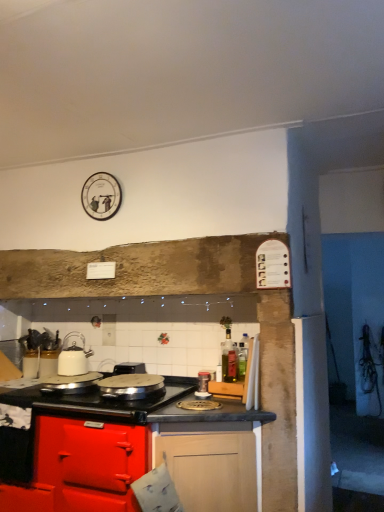
Describe the element at coordinates (71, 383) in the screenshot. This screenshot has height=512, width=384. I see `shiny silver pan at center, placed as the 3th kitchen appliance when sorted from right to left` at that location.

Image resolution: width=384 pixels, height=512 pixels. What are the coordinates of `black plastic toaster at center` in the screenshot? It's located at (129, 368).

From a real-world perspective, which object stands above the other?

white glossy kettle at left, marked as the second kitchen appliance in a right-to-left arrangement, from a real-world perspective.

Can you confirm if white glossy kettle at left, marked as the second kitchen appliance in a left-to-right arrangement, is taller than glossy wood cabinet at lower center?

No, white glossy kettle at left, marked as the second kitchen appliance in a left-to-right arrangement, is not taller than glossy wood cabinet at lower center.

What are the coordinates of `cabinetry located below the white glossy kettle at left, marked as the second kitchen appliance in a left-to-right arrangement (from the image's perspective)` in the screenshot? It's located at (131, 452).

Could you measure the distance between white glossy kettle at left, marked as the second kitchen appliance in a left-to-right arrangement, and glossy wood cabinet at lower center?

A distance of 25.98 inches exists between white glossy kettle at left, marked as the second kitchen appliance in a left-to-right arrangement, and glossy wood cabinet at lower center.

From the picture: How different are the orientations of white glossy kettle at left, marked as the second kitchen appliance in a right-to-left arrangement, and green glass bottle at center in degrees?

They differ by 2.81 degrees in their facing directions.

Considering the sizes of objects white glossy kettle at left, marked as the second kitchen appliance in a left-to-right arrangement, and green glass bottle at center in the image provided, who is taller, white glossy kettle at left, marked as the second kitchen appliance in a left-to-right arrangement, or green glass bottle at center?

Standing taller between the two is white glossy kettle at left, marked as the second kitchen appliance in a left-to-right arrangement.

Is white glossy kettle at left, marked as the second kitchen appliance in a left-to-right arrangement, turned away from green glass bottle at center?

No.

Which of these two, white glossy kettle at left, marked as the second kitchen appliance in a left-to-right arrangement, or green glass bottle at center, is wider?

white glossy kettle at left, marked as the second kitchen appliance in a left-to-right arrangement, is wider.

Which is more distant, (61,387) or (187,410)?

Point (61,387)

Does shiny silver pan at center, placed as the 3th kitchen appliance when sorted from right to left, have a larger size compared to glossy wood cabinet at lower center?

No, shiny silver pan at center, placed as the 3th kitchen appliance when sorted from right to left, is not bigger than glossy wood cabinet at lower center.

Does shiny silver pan at center, placed as the 3th kitchen appliance when sorted from right to left, appear on the right side of glossy wood cabinet at lower center?

No.

From the image's perspective, does shiny silver pan at center, placed as the 3th kitchen appliance when sorted from right to left, appear lower than glossy wood cabinet at lower center?

Actually, shiny silver pan at center, placed as the 3th kitchen appliance when sorted from right to left, appears above glossy wood cabinet at lower center in the image.

Is the depth of metallic silver canister at center, which appears as the third kitchen appliance when viewed from the left, less than that of glossy wood cabinet at lower center?

No, metallic silver canister at center, which appears as the third kitchen appliance when viewed from the left, is further to the viewer.

From a real-world perspective, which object rests below the other?

From a 3D spatial view, glossy wood cabinet at lower center is below.

How far apart are metallic silver canister at center, which appears as the third kitchen appliance when viewed from the left, and glossy wood cabinet at lower center?

The distance of metallic silver canister at center, which appears as the third kitchen appliance when viewed from the left, from glossy wood cabinet at lower center is 22.58 inches.

Considering the relative sizes of metallic silver canister at center, the 1th kitchen appliance from the right, and glossy wood cabinet at lower center in the image provided, is metallic silver canister at center, the 1th kitchen appliance from the right, wider than glossy wood cabinet at lower center?

Incorrect, the width of metallic silver canister at center, the 1th kitchen appliance from the right, does not surpass that of glossy wood cabinet at lower center.

Based on the photo, is metallic silver canister at center, which appears as the third kitchen appliance when viewed from the left, turned away from white glossy kettle at left, marked as the second kitchen appliance in a left-to-right arrangement?

metallic silver canister at center, which appears as the third kitchen appliance when viewed from the left, is not turned away from white glossy kettle at left, marked as the second kitchen appliance in a left-to-right arrangement.

Does point (210, 393) appear closer or farther from the camera than point (72, 346)?

Point (210, 393) is closer to the camera than point (72, 346).

From the image's perspective, is metallic silver canister at center, which appears as the third kitchen appliance when viewed from the left, positioned above or below white glossy kettle at left, marked as the second kitchen appliance in a right-to-left arrangement?

From the image's perspective, metallic silver canister at center, which appears as the third kitchen appliance when viewed from the left, appears below white glossy kettle at left, marked as the second kitchen appliance in a right-to-left arrangement.

Is metallic silver canister at center, the 1th kitchen appliance from the right, closer to the viewer compared to white glossy kettle at left, marked as the second kitchen appliance in a left-to-right arrangement?

Yes, metallic silver canister at center, the 1th kitchen appliance from the right, is in front of white glossy kettle at left, marked as the second kitchen appliance in a left-to-right arrangement.

Between glossy wood cabinet at lower center and white glossy kettle at left, marked as the second kitchen appliance in a right-to-left arrangement, which one appears on the right side from the viewer's perspective?

glossy wood cabinet at lower center.

Who is taller, glossy wood cabinet at lower center or white glossy kettle at left, marked as the second kitchen appliance in a right-to-left arrangement?

With more height is glossy wood cabinet at lower center.

Is white glossy kettle at left, marked as the second kitchen appliance in a left-to-right arrangement, surrounded by glossy wood cabinet at lower center?

No.

Is shiny silver pan at center, the 1th kitchen appliance from the left, to the right of green glass bottle at center from the viewer's perspective?

No, shiny silver pan at center, the 1th kitchen appliance from the left, is not to the right of green glass bottle at center.

Does shiny silver pan at center, the 1th kitchen appliance from the left, come in front of green glass bottle at center?

Yes, it is.

From a real-world perspective, is shiny silver pan at center, the 1th kitchen appliance from the left, physically located above or below green glass bottle at center?

From a real-world perspective, shiny silver pan at center, the 1th kitchen appliance from the left, is physically below green glass bottle at center.

Is shiny silver pan at center, placed as the 3th kitchen appliance when sorted from right to left, not within green glass bottle at center?

shiny silver pan at center, placed as the 3th kitchen appliance when sorted from right to left, lies outside green glass bottle at center's area.

You are a GUI agent. You are given a task and a screenshot of the screen. Output one action in this format:
    pyautogui.click(x=<x>, y=<y>)
    Task: Click on the 3rd kitchen appliance behind when counting from the glossy wood cabinet at lower center
    The image size is (384, 512).
    Given the screenshot: What is the action you would take?
    pyautogui.click(x=73, y=357)

Locate an element on the screen. bottle that is below the white glossy kettle at left, marked as the second kitchen appliance in a left-to-right arrangement (from the image's perspective) is located at coordinates (229, 359).

When comparing their distances from metallic silver canister at center, which appears as the third kitchen appliance when viewed from the left, does white glossy kettle at left, marked as the second kitchen appliance in a right-to-left arrangement, or glossy wood cabinet at lower center seem further?

Based on the image, white glossy kettle at left, marked as the second kitchen appliance in a right-to-left arrangement, appears to be further to metallic silver canister at center, which appears as the third kitchen appliance when viewed from the left.

Estimate the real-world distances between objects in this image. Which object is further from black plastic toaster at center, white glossy kettle at left, marked as the second kitchen appliance in a right-to-left arrangement, or green glass bottle at center?

The object further to black plastic toaster at center is green glass bottle at center.

Looking at the image, which one is located closer to metallic silver canister at center, the 1th kitchen appliance from the right, black plastic toaster at center or green glass bottle at center?

Among the two, green glass bottle at center is located nearer to metallic silver canister at center, the 1th kitchen appliance from the right.

When comparing their distances from white glossy kettle at left, marked as the second kitchen appliance in a left-to-right arrangement, does glossy wood cabinet at lower center or black plastic toaster at center seem closer?

black plastic toaster at center lies closer to white glossy kettle at left, marked as the second kitchen appliance in a left-to-right arrangement, than the other object.

Based on their spatial positions, is metallic silver canister at center, the 1th kitchen appliance from the right, or shiny silver pan at center, the 1th kitchen appliance from the left, closer to white glossy kettle at left, marked as the second kitchen appliance in a right-to-left arrangement?

shiny silver pan at center, the 1th kitchen appliance from the left, is positioned closer to the anchor white glossy kettle at left, marked as the second kitchen appliance in a right-to-left arrangement.

Looking at the image, which one is located closer to shiny silver pan at center, placed as the 3th kitchen appliance when sorted from right to left, green glass bottle at center or metallic silver canister at center, the 1th kitchen appliance from the right?

metallic silver canister at center, the 1th kitchen appliance from the right, is closer to shiny silver pan at center, placed as the 3th kitchen appliance when sorted from right to left.

From the image, which object appears to be farther from shiny silver pan at center, the 1th kitchen appliance from the left, white glossy kettle at left, marked as the second kitchen appliance in a right-to-left arrangement, or glossy wood cabinet at lower center?

glossy wood cabinet at lower center is further to shiny silver pan at center, the 1th kitchen appliance from the left.

Considering their positions, is metallic silver canister at center, the 1th kitchen appliance from the right, positioned further to shiny silver pan at center, placed as the 3th kitchen appliance when sorted from right to left, than white glossy kettle at left, marked as the second kitchen appliance in a right-to-left arrangement?

metallic silver canister at center, the 1th kitchen appliance from the right, is further to shiny silver pan at center, placed as the 3th kitchen appliance when sorted from right to left.

You are a GUI agent. You are given a task and a screenshot of the screen. Output one action in this format:
    pyautogui.click(x=<x>, y=<y>)
    Task: Click on the kitchen appliance situated between glossy wood cabinet at lower center and green glass bottle at center from left to right
    The image size is (384, 512).
    Given the screenshot: What is the action you would take?
    pyautogui.click(x=203, y=385)

The image size is (384, 512). I want to click on appliance between white glossy kettle at left, marked as the second kitchen appliance in a left-to-right arrangement, and metallic silver canister at center, the 1th kitchen appliance from the right, so click(x=129, y=368).

You are a GUI agent. You are given a task and a screenshot of the screen. Output one action in this format:
    pyautogui.click(x=<x>, y=<y>)
    Task: Click on the cabinetry between white glossy kettle at left, marked as the second kitchen appliance in a left-to-right arrangement, and metallic silver canister at center, the 1th kitchen appliance from the right, in the horizontal direction
    
    Given the screenshot: What is the action you would take?
    pyautogui.click(x=131, y=452)

Locate an element on the screen. Image resolution: width=384 pixels, height=512 pixels. kitchen appliance between shiny silver pan at center, placed as the 3th kitchen appliance when sorted from right to left, and black plastic toaster at center from left to right is located at coordinates (73, 357).